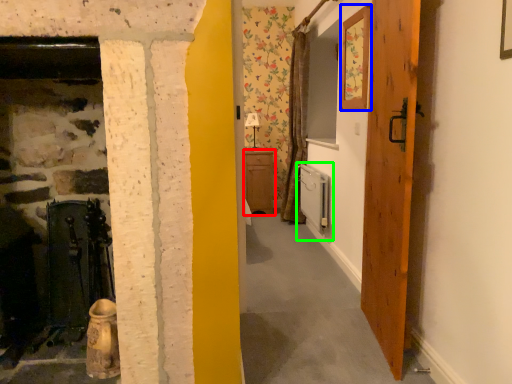
Question: Which object is the farthest from cabinetry (highlighted by a red box)? Choose among these: picture frame (highlighted by a blue box) or appliance (highlighted by a green box).

Choices:
 (A) picture frame
 (B) appliance

Answer: (A)